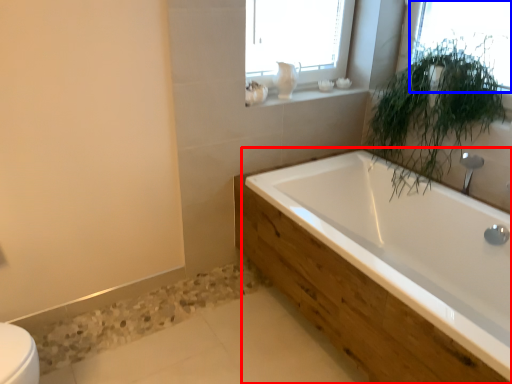
Question: Among these objects, which one is farthest to the camera, bathtub (highlighted by a red box) or window (highlighted by a blue box)?

Choices:
 (A) bathtub
 (B) window

Answer: (B)